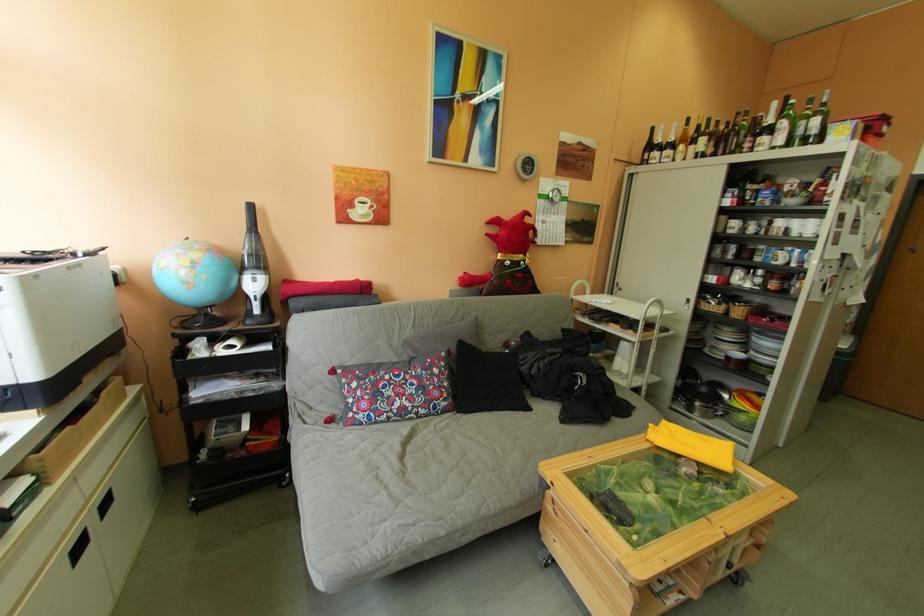
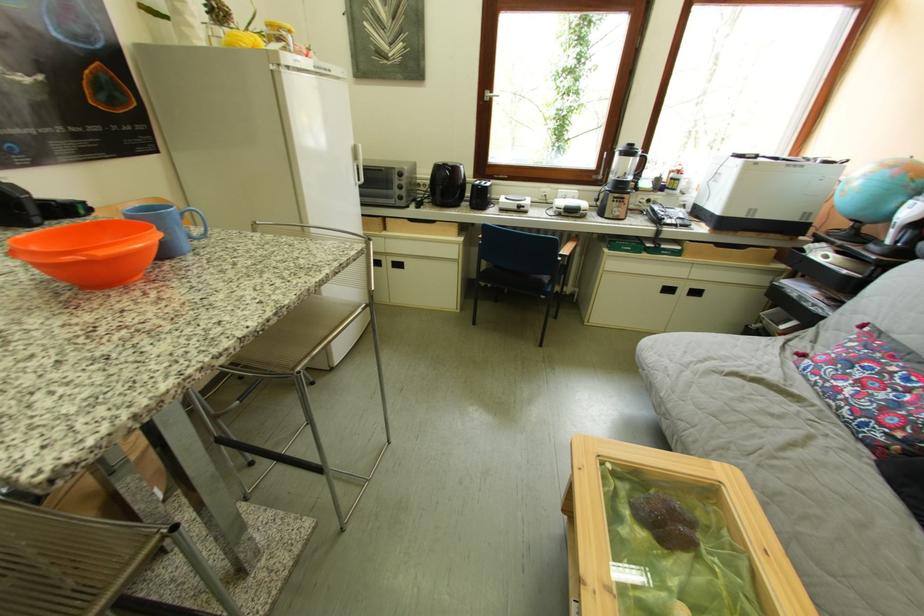
Question: I am providing you with two images of the same scene from different viewpoints. After the viewpoint changes to image2, which objects are now occluded?

Choices:
 (A) cabinet handle cutout
 (B) patterned pillow
 (C) blue chair sitting surface
 (D) none of these

Answer: (D)